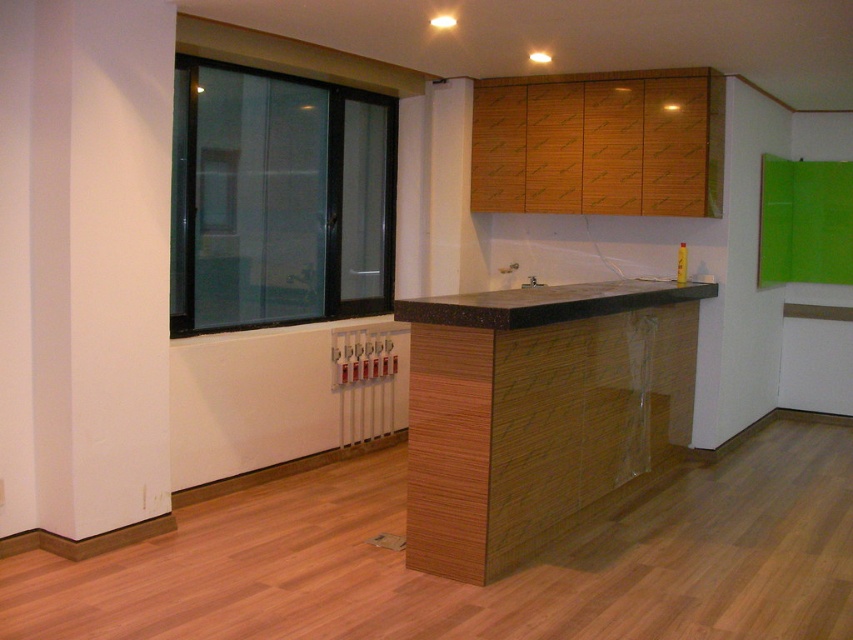
Question: Is black glass window at left thinner than black marble countertop at center?

Choices:
 (A) no
 (B) yes

Answer: (B)

Question: Can you confirm if black glass window at left is bigger than black marble countertop at center?

Choices:
 (A) no
 (B) yes

Answer: (B)

Question: Which of the following is the closest to the observer?

Choices:
 (A) black glass window at left
 (B) black marble countertop at center

Answer: (B)

Question: Is black glass window at left further to camera compared to black marble countertop at center?

Choices:
 (A) no
 (B) yes

Answer: (B)